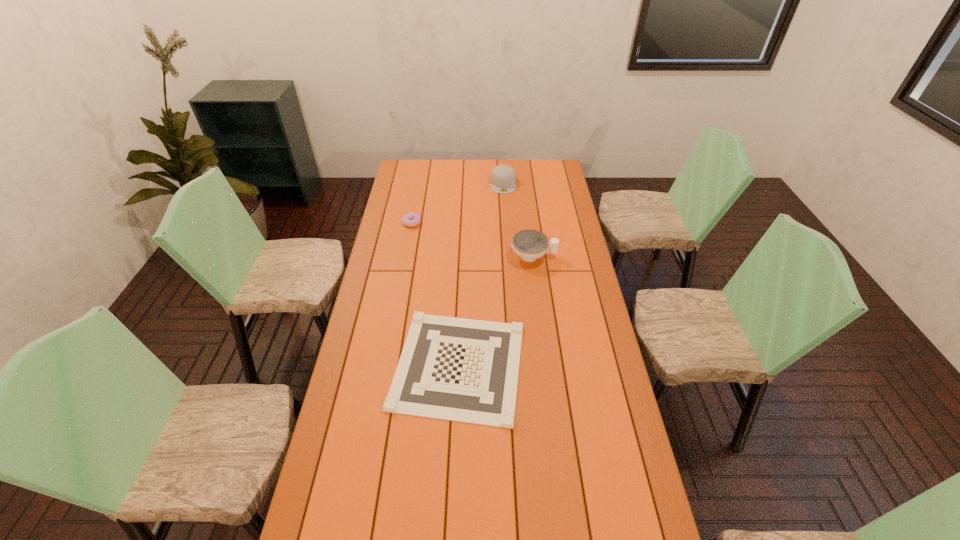
I want to click on vacant area that lies between the second shortest object and the second nearest object, so click(472, 239).

At what (x,y) coordinates should I click in order to perform the action: click on free space that is in between the farthest object and the nearest object. Please return your answer as a coordinate pair (x, y). The width and height of the screenshot is (960, 540). Looking at the image, I should click on (481, 274).

The width and height of the screenshot is (960, 540). Find the location of `free space between the cap and the third tallest object`. free space between the cap and the third tallest object is located at coordinates (458, 203).

You are a GUI agent. You are given a task and a screenshot of the screen. Output one action in this format:
    pyautogui.click(x=<x>, y=<y>)
    Task: Click on the empty location between the shortest object and the chinaware
    The width and height of the screenshot is (960, 540).
    Given the screenshot: What is the action you would take?
    pyautogui.click(x=496, y=310)

At what (x,y) coordinates should I click in order to perform the action: click on free space that is in between the chinaware and the nearest object. Please return your answer as a coordinate pair (x, y). Looking at the image, I should click on (496, 310).

Identify the location of free space between the chinaware and the cap. The height and width of the screenshot is (540, 960). (518, 220).

This screenshot has width=960, height=540. I want to click on free space between the second shortest object and the cap, so click(458, 203).

Where is `the closest object to the nearest object`? the closest object to the nearest object is located at coordinates (530, 245).

Locate an element on the screen. object that is the second closest one to the farthest object is located at coordinates (530, 245).

You are a GUI agent. You are given a task and a screenshot of the screen. Output one action in this format:
    pyautogui.click(x=<x>, y=<y>)
    Task: Click on the vacant space that satisfies the following two spatial constraints: 1. on the front side of the nearest object; 2. on the right side of the third tallest object
    
    Given the screenshot: What is the action you would take?
    pyautogui.click(x=386, y=365)